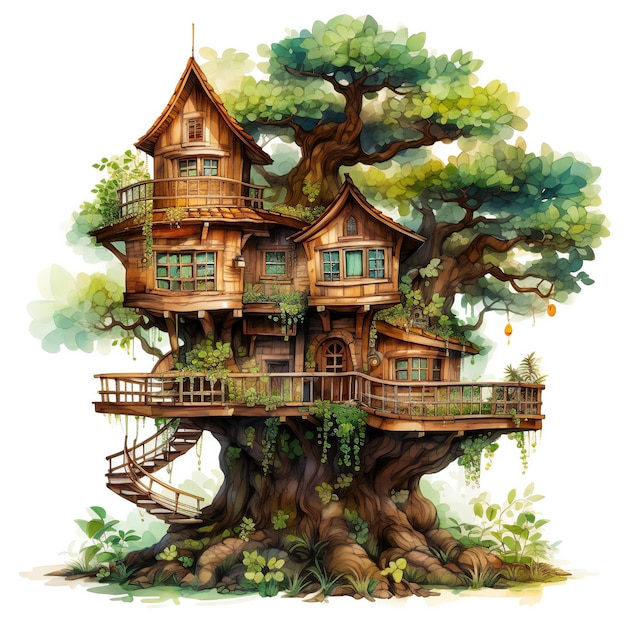
The width and height of the screenshot is (626, 626). I want to click on stairs, so click(x=170, y=516), click(x=134, y=495), click(x=116, y=464), click(x=149, y=447), click(x=183, y=427).